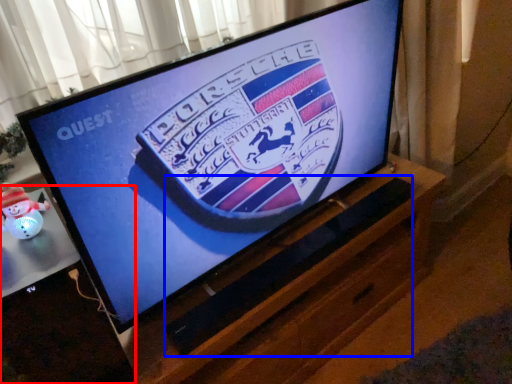
Question: Which of the following is the closest to the observer, desktop (highlighted by a red box) or speaker (highlighted by a blue box)?

Choices:
 (A) desktop
 (B) speaker

Answer: (A)